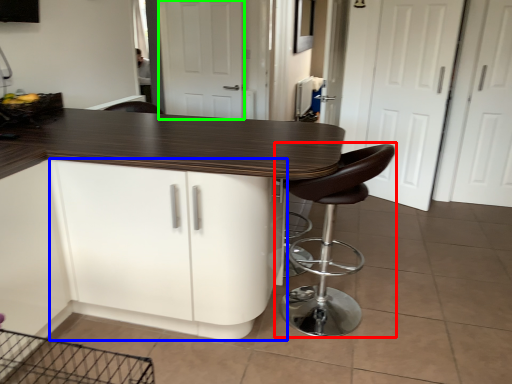
Question: Which is farther away from chair (highlighted by a red box)? cabinetry (highlighted by a blue box) or screen door (highlighted by a green box)?

Choices:
 (A) cabinetry
 (B) screen door

Answer: (B)